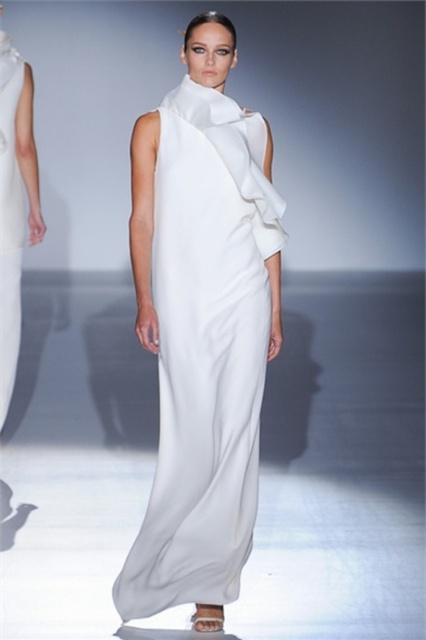
Between white satin dress at center and matte white dress at left, which one is positioned lower?

white satin dress at center

Does white satin dress at center appear over matte white dress at left?

Actually, white satin dress at center is below matte white dress at left.

The height and width of the screenshot is (640, 426). I want to click on white satin dress at center, so click(x=201, y=330).